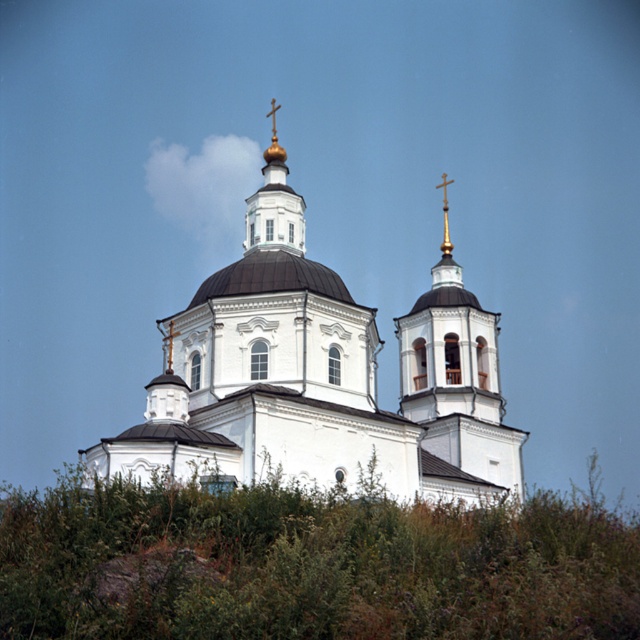
You are standing in front of the church and want to place a small statue exactly at the center of the green leafy bush at center. What are the coordinates where you should place it?

The coordinates for the center of the green leafy bush at center are point (310,564).

You are standing at the coordinates 0.5, 0.5 in the image. Can you see the white smooth church at center from your current position?

Yes, the white smooth church at center is located at point (321, 378), so you can see it from your position at (320, 320) as it is very close.

Based on the photo, you are a photographer planning to capture the white smooth church at center and the gold metallic cross at upper center in a single frame. Based on their sizes, which object would appear more prominent in the photo?

The white smooth church at center would appear more prominent in the photo because it is larger in size than the gold metallic cross at upper center.